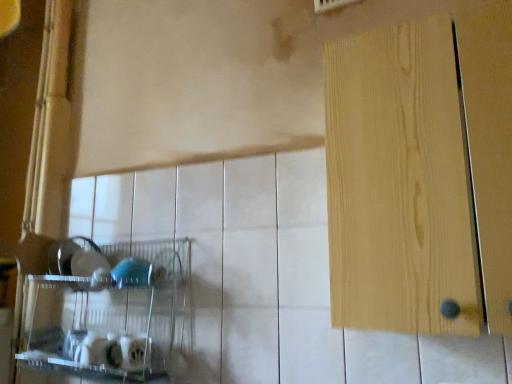
Image resolution: width=512 pixels, height=384 pixels. What do you see at coordinates (400, 183) in the screenshot? I see `light wood door at right` at bounding box center [400, 183].

You are a GUI agent. You are given a task and a screenshot of the screen. Output one action in this format:
    pyautogui.click(x=<x>, y=<y>)
    Task: Click on the light wood door at right
    
    Given the screenshot: What is the action you would take?
    [x=400, y=183]

Find the location of a particular element. clear plastic shelf at lower left is located at coordinates (106, 313).

The image size is (512, 384). Describe the element at coordinates (106, 313) in the screenshot. I see `clear plastic shelf at lower left` at that location.

Based on the photo, what is the approximate height of clear plastic shelf at lower left?

clear plastic shelf at lower left is 50.40 centimeters tall.

Identify the location of light wood door at right. (400, 183).

Is clear plastic shelf at lower left to the left or to the right of light wood door at right in the image?

clear plastic shelf at lower left is to the left of light wood door at right.

Does clear plastic shelf at lower left come in front of light wood door at right?

No, clear plastic shelf at lower left is further to the viewer.

Is point (170, 319) positioned in front of point (352, 245)?

No, it is behind (352, 245).

From the image's perspective, which object appears higher, clear plastic shelf at lower left or light wood door at right?

light wood door at right, from the image's perspective.

From a real-world perspective, is clear plastic shelf at lower left physically above light wood door at right?

No, from a real-world perspective, clear plastic shelf at lower left is not above light wood door at right.

Between clear plastic shelf at lower left and light wood door at right, which one has smaller width?

Thinner between the two is clear plastic shelf at lower left.

Who is shorter, clear plastic shelf at lower left or light wood door at right?

clear plastic shelf at lower left is shorter.

Considering the relative sizes of clear plastic shelf at lower left and light wood door at right in the image provided, is clear plastic shelf at lower left smaller than light wood door at right?

Yes, clear plastic shelf at lower left is smaller than light wood door at right.

From the picture: Is clear plastic shelf at lower left inside or outside of light wood door at right?

The correct answer is: outside.

Are clear plastic shelf at lower left and light wood door at right making contact?

No, clear plastic shelf at lower left is not next to light wood door at right.

Is clear plastic shelf at lower left oriented away from light wood door at right?

No.

This screenshot has width=512, height=384. Find the location of `shelf located underneath the light wood door at right (from a real-world perspective)`. shelf located underneath the light wood door at right (from a real-world perspective) is located at coordinates (106, 313).

Is light wood door at right to the left or to the right of clear plastic shelf at lower left in the image?

Based on their positions, light wood door at right is located to the right of clear plastic shelf at lower left.

Relative to clear plastic shelf at lower left, is light wood door at right in front or behind?

Clearly, light wood door at right is in front of clear plastic shelf at lower left.

Is point (399, 255) behind point (84, 326)?

No, (399, 255) is in front of (84, 326).

From the image's perspective, would you say light wood door at right is positioned over clear plastic shelf at lower left?

Yes.

From a real-world perspective, does light wood door at right stand above clear plastic shelf at lower left?

Indeed, from a real-world perspective, light wood door at right stands above clear plastic shelf at lower left.

Considering the relative sizes of light wood door at right and clear plastic shelf at lower left in the image provided, is light wood door at right wider than clear plastic shelf at lower left?

Yes, light wood door at right is wider than clear plastic shelf at lower left.

Which of these two, light wood door at right or clear plastic shelf at lower left, stands shorter?

With less height is clear plastic shelf at lower left.

Between light wood door at right and clear plastic shelf at lower left, which one has smaller size?

With smaller size is clear plastic shelf at lower left.

Do you think light wood door at right is within clear plastic shelf at lower left, or outside of it?

light wood door at right is not enclosed by clear plastic shelf at lower left.

Is light wood door at right next to clear plastic shelf at lower left?

No, light wood door at right is not beside clear plastic shelf at lower left.

Is clear plastic shelf at lower left at the back of light wood door at right?

That's not correct — light wood door at right is not looking away from clear plastic shelf at lower left.

This screenshot has width=512, height=384. Find the location of `shelf on the left side of light wood door at right`. shelf on the left side of light wood door at right is located at coordinates (106, 313).

This screenshot has height=384, width=512. I want to click on shelf on the left of light wood door at right, so click(x=106, y=313).

Locate an element on the screen. The width and height of the screenshot is (512, 384). door that appears above the clear plastic shelf at lower left (from a real-world perspective) is located at coordinates (400, 183).